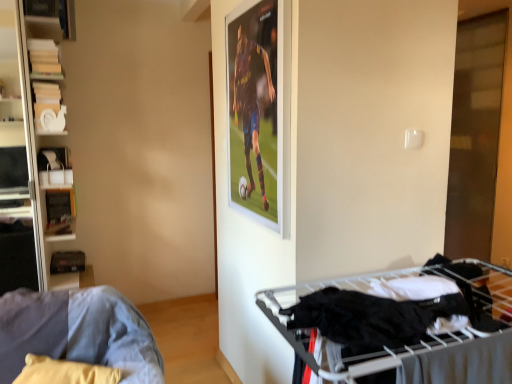
Question: Does point (353, 299) appear closer or farther from the camera than point (53, 107)?

Choices:
 (A) farther
 (B) closer

Answer: (B)

Question: From a real-world perspective, is black fabric at lower right above or below white matte bookshelf at left?

Choices:
 (A) above
 (B) below

Answer: (B)

Question: Estimate the real-world distances between objects in this image. Which object is closer to the denim fabric couch at lower left?

Choices:
 (A) white matte bookshelf at left
 (B) black fabric at lower right
 (C) transparent glass door at right

Answer: (B)

Question: Estimate the real-world distances between objects in this image. Which object is closer to the transparent glass door at right?

Choices:
 (A) white matte bookshelf at left
 (B) denim fabric couch at lower left
 (C) black fabric at lower right

Answer: (C)